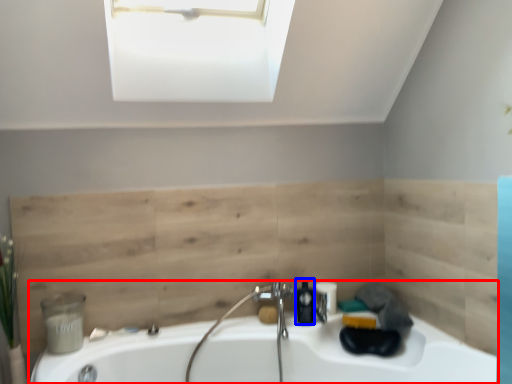
Question: Which object appears closest to the camera in this image, bathtub (highlighted by a red box) or soap dispenser (highlighted by a blue box)?

Choices:
 (A) bathtub
 (B) soap dispenser

Answer: (A)